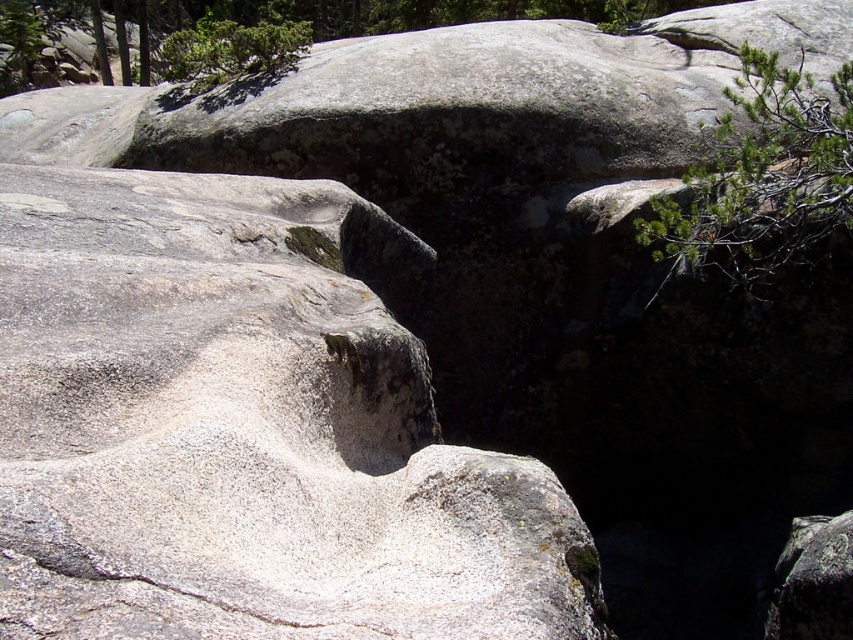
You are navigating through the rugged landscape and need to reach the point at coordinates point (260, 35). You are currently at point (799, 198). Based on the image, which direction should you move to get closer to your destination?

Since point (799, 198) is in front of point (260, 35), you should move backward to reach your destination.